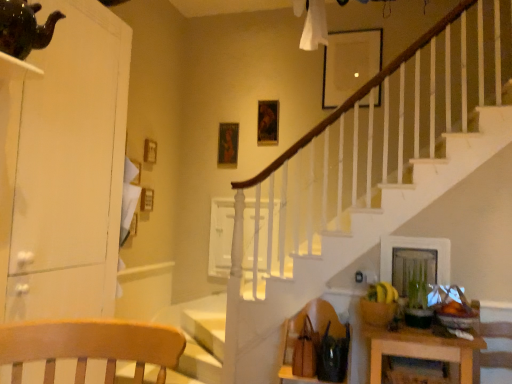
Question: Is green matte plant at lower right wider than white glossy dresser at left?

Choices:
 (A) no
 (B) yes

Answer: (A)

Question: Considering the relative positions of green matte plant at lower right and white glossy dresser at left in the image provided, is green matte plant at lower right to the right of white glossy dresser at left from the viewer's perspective?

Choices:
 (A) no
 (B) yes

Answer: (B)

Question: From the image's perspective, would you say green matte plant at lower right is positioned over white glossy dresser at left?

Choices:
 (A) yes
 (B) no

Answer: (B)

Question: Can you confirm if green matte plant at lower right is positioned to the left of white glossy dresser at left?

Choices:
 (A) yes
 (B) no

Answer: (B)

Question: Is green matte plant at lower right turned away from white glossy dresser at left?

Choices:
 (A) yes
 (B) no

Answer: (B)

Question: Are green matte plant at lower right and white glossy dresser at left located far from each other?

Choices:
 (A) no
 (B) yes

Answer: (B)

Question: Is wooden table at lower right closer to camera compared to white glossy dresser at left?

Choices:
 (A) no
 (B) yes

Answer: (A)

Question: From a real-world perspective, does wooden table at lower right sit lower than white glossy dresser at left?

Choices:
 (A) yes
 (B) no

Answer: (A)

Question: From the image's perspective, is wooden table at lower right on white glossy dresser at left?

Choices:
 (A) no
 (B) yes

Answer: (A)

Question: Would you say wooden table at lower right is a long distance from white glossy dresser at left?

Choices:
 (A) no
 (B) yes

Answer: (B)

Question: Is wooden table at lower right to the right of white glossy dresser at left from the viewer's perspective?

Choices:
 (A) yes
 (B) no

Answer: (A)

Question: Can you confirm if wooden table at lower right is bigger than white glossy dresser at left?

Choices:
 (A) no
 (B) yes

Answer: (A)

Question: Is brown leather armchair at lower right beside green matte plant at lower right?

Choices:
 (A) no
 (B) yes

Answer: (A)